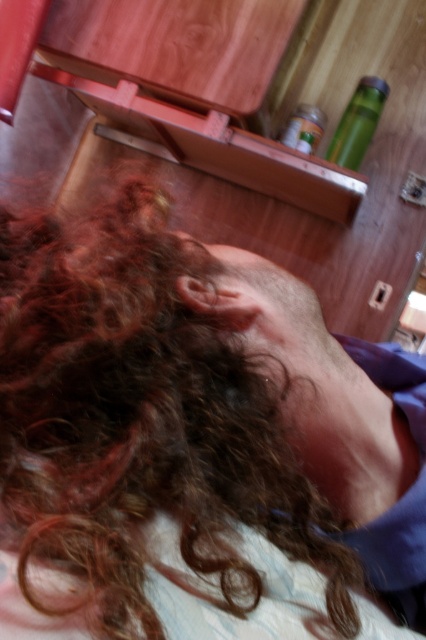
Is curly brown hair at center thinner than green matte bottle at upper right?

No, curly brown hair at center is not thinner than green matte bottle at upper right.

Is point (186, 504) positioned in front of point (371, 125)?

Yes, point (186, 504) is closer to viewer.

Which is in front, point (169, 372) or point (382, 99)?

Positioned in front is point (169, 372).

Where is `curly brown hair at center`? curly brown hair at center is located at coordinates (138, 419).